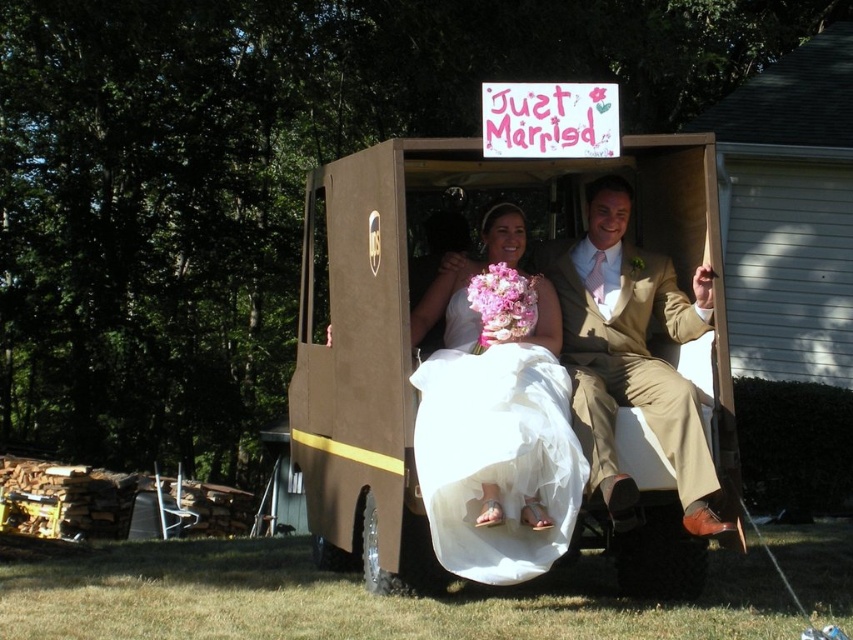
Question: Is brown cardboard golf cart at center smaller than tan fabric suit at center?

Choices:
 (A) yes
 (B) no

Answer: (B)

Question: Does brown cardboard golf cart at center lie behind tan fabric suit at center?

Choices:
 (A) yes
 (B) no

Answer: (A)

Question: Does brown cardboard golf cart at center appear on the right side of white satin dress at center?

Choices:
 (A) no
 (B) yes

Answer: (A)

Question: Which of the following is the closest to the observer?

Choices:
 (A) (492, 278)
 (B) (494, 246)
 (C) (378, 266)
 (D) (576, 401)

Answer: (D)

Question: Which point is closer to the camera?

Choices:
 (A) (381, 502)
 (B) (526, 432)

Answer: (B)

Question: Which of these objects is positioned closest to the pink silk bouquet at center?

Choices:
 (A) brown cardboard golf cart at center
 (B) white satin dress at center

Answer: (B)